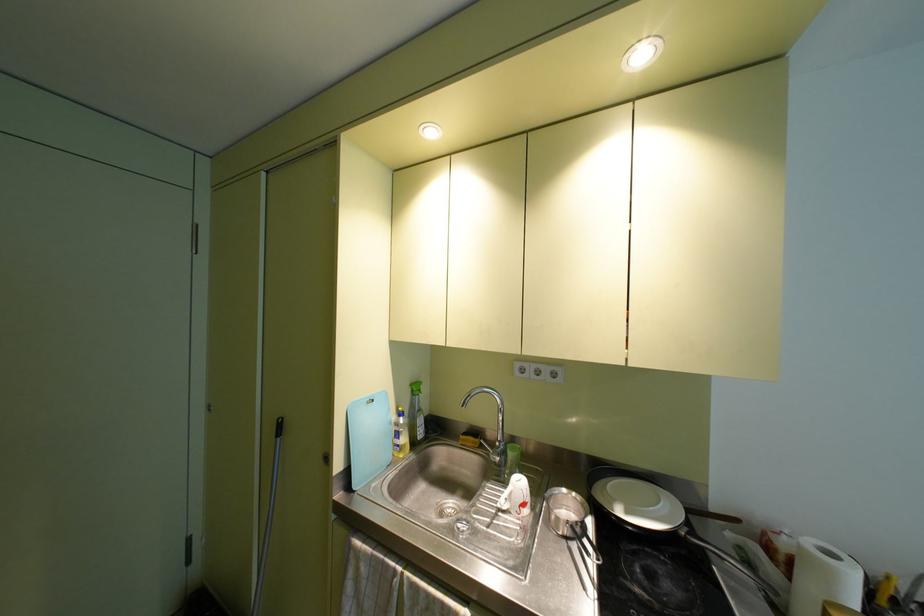
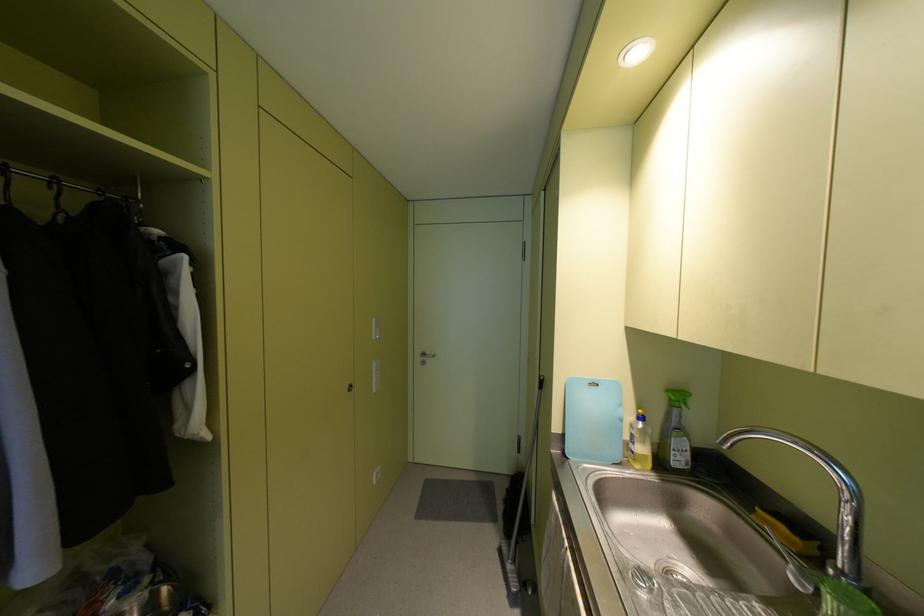
Locate, in the second image, the point that corresponds to (416,392) in the first image.

(675, 403)